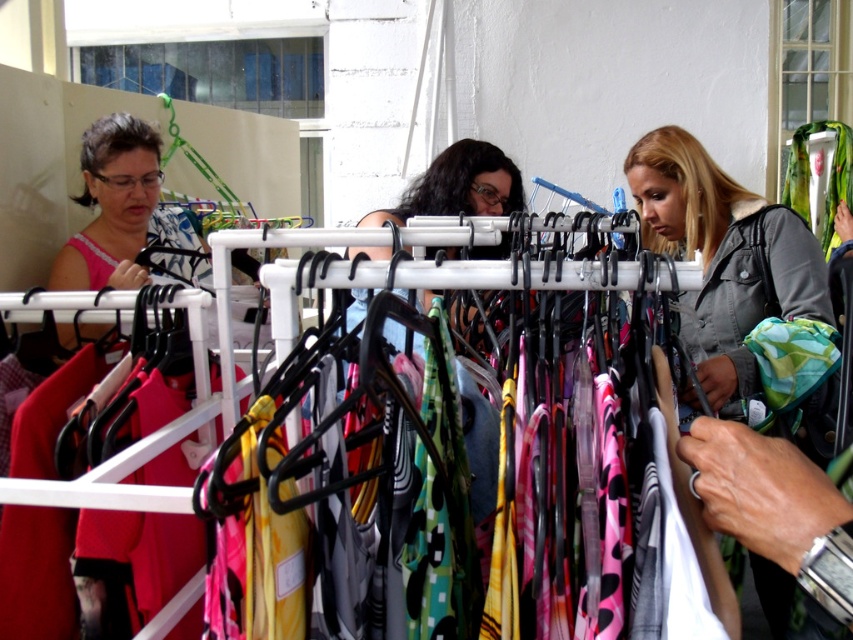
You are standing in the clothing store and want to find the gray denim jacket at center. According to the store layout, where should you look relative to the window?

The gray denim jacket at center is located at point 0.400 on the horizontal axis and 0.849 on the vertical axis, which places it closer to the right side and lower part of the store near the window.

You are a customer in the store looking for a jacket and a dress. You see the gray denim jacket at center and the matte black dress at center. Which item is positioned to the right of the other?

The gray denim jacket at center is to the right of the matte black dress at center.

In the scene shown: You are a customer in the store and want to pick up the gray denim jacket at center and the green and white patterned fabric at right. Which item will you reach first if you walk straight towards them?

You will reach the gray denim jacket at center first because it is closer to you than the green and white patterned fabric at right, which is further away.